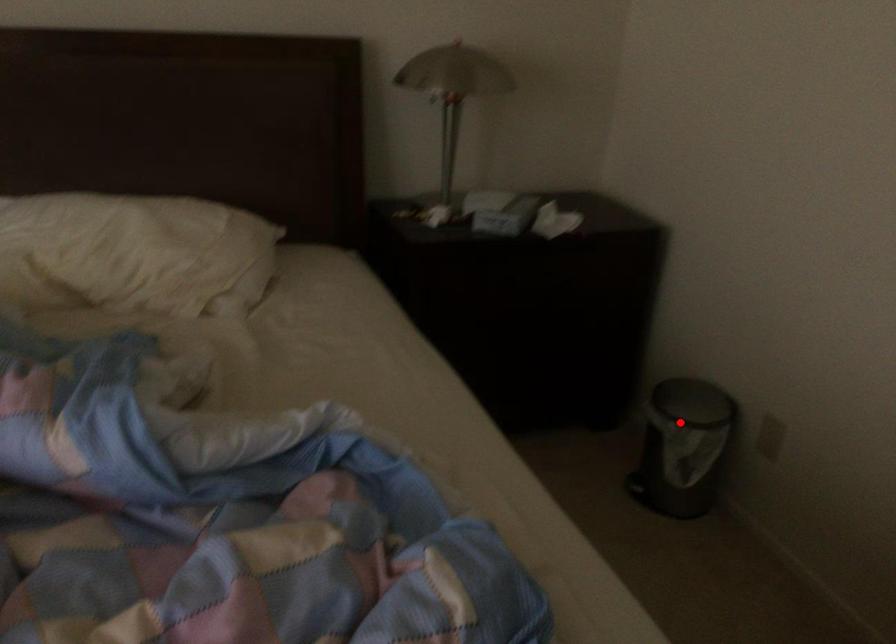
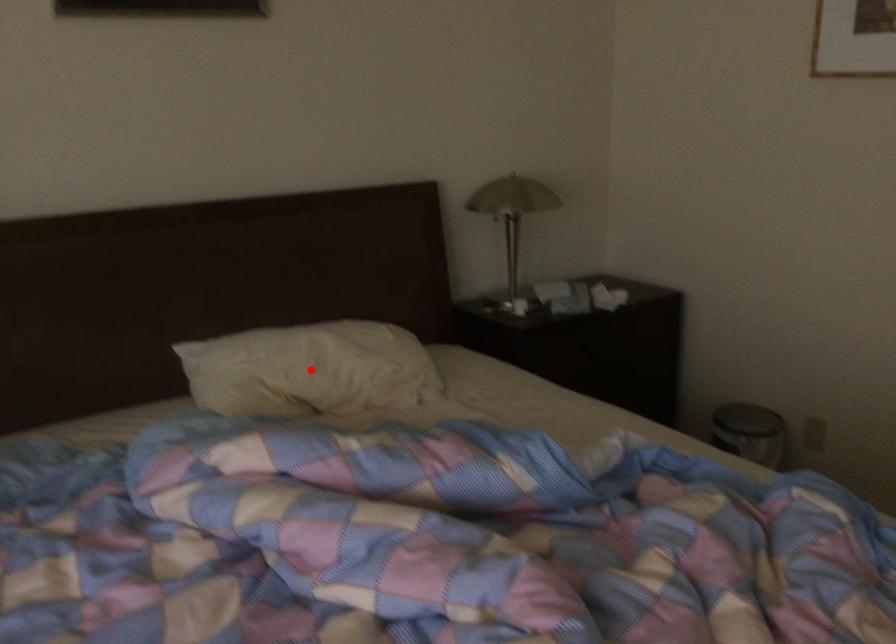
I am providing you with two images of the same scene from different viewpoints. A red point is marked on the first image and another point is marked on the second image. Does the point marked in image1 correspond to the same location as the one in image2?

No